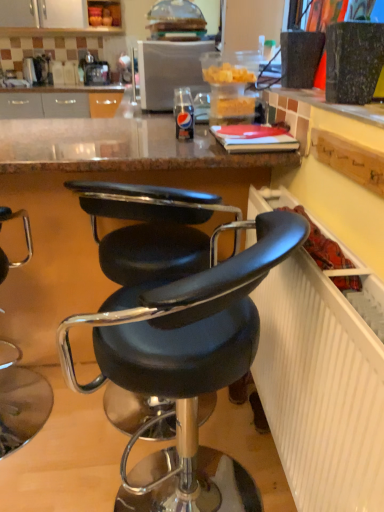
The height and width of the screenshot is (512, 384). Describe the element at coordinates (169, 71) in the screenshot. I see `satin silver microwave at upper center` at that location.

This screenshot has width=384, height=512. Describe the element at coordinates (21, 403) in the screenshot. I see `black leather stool at lower left, the second chair when ordered from right to left` at that location.

This screenshot has height=512, width=384. Find the location of `black leather chair at center, the 1th chair in the right-to-left sequence`. black leather chair at center, the 1th chair in the right-to-left sequence is located at coordinates (186, 367).

You are a GUI agent. You are given a task and a screenshot of the screen. Output one action in this format:
    pyautogui.click(x=<x>, y=<y>)
    Task: Click on the satin silver microwave at upper center
    The width and height of the screenshot is (384, 512).
    Given the screenshot: What is the action you would take?
    pyautogui.click(x=169, y=71)

What's the angular difference between black leather chair at center, positioned as the 2th chair in left-to-right order, and satin silver microwave at upper center's facing directions?

black leather chair at center, positioned as the 2th chair in left-to-right order, and satin silver microwave at upper center are facing 91.2 degrees away from each other.

Between black leather chair at center, positioned as the 2th chair in left-to-right order, and satin silver microwave at upper center, which one has larger size?

black leather chair at center, positioned as the 2th chair in left-to-right order, is bigger.

From the image's perspective, which is below, black leather chair at center, the 1th chair in the right-to-left sequence, or satin silver microwave at upper center?

black leather chair at center, the 1th chair in the right-to-left sequence, is shown below in the image.

Where is `appliance above the black leather chair at center, positioned as the 2th chair in left-to-right order (from a real-world perspective)`? appliance above the black leather chair at center, positioned as the 2th chair in left-to-right order (from a real-world perspective) is located at coordinates (169, 71).

Consider the image. From the image's perspective, which object appears higher, black leather chair at center, positioned as the 2th chair in left-to-right order, or black leather stool at lower left, the second chair when ordered from right to left?

black leather stool at lower left, the second chair when ordered from right to left, is shown above in the image.

How much distance is there between black leather chair at center, the 1th chair in the right-to-left sequence, and black leather stool at lower left, marked as the 1th chair in a left-to-right arrangement?

They are 28.07 inches apart.

Is point (163, 311) behind point (47, 397)?

No, (163, 311) is closer to viewer.

Is black leather stool at lower left, the second chair when ordered from right to left, positioned before white textured radiator at lower right?

No, black leather stool at lower left, the second chair when ordered from right to left, is further to the viewer.

Which is in front, point (1, 276) or point (278, 281)?

Positioned in front is point (278, 281).

From the image's perspective, which one is positioned lower, black leather stool at lower left, marked as the 1th chair in a left-to-right arrangement, or white textured radiator at lower right?

white textured radiator at lower right appears lower in the image.

In the scene shown: Can you confirm if black leather stool at lower left, the second chair when ordered from right to left, is smaller than white textured radiator at lower right?

No, black leather stool at lower left, the second chair when ordered from right to left, is not smaller than white textured radiator at lower right.

From the image's perspective, would you say black leather stool at lower left, marked as the 1th chair in a left-to-right arrangement, is shown under black leather chair at center, positioned as the 2th chair in left-to-right order?

No, from the image's perspective, black leather stool at lower left, marked as the 1th chair in a left-to-right arrangement, is not beneath black leather chair at center, positioned as the 2th chair in left-to-right order.

Does black leather stool at lower left, the second chair when ordered from right to left, lie in front of black leather chair at center, positioned as the 2th chair in left-to-right order?

No, it is behind black leather chair at center, positioned as the 2th chair in left-to-right order.

Based on the photo, are black leather stool at lower left, the second chair when ordered from right to left, and black leather chair at center, the 1th chair in the right-to-left sequence, located far from each other?

black leather stool at lower left, the second chair when ordered from right to left, is actually quite close to black leather chair at center, the 1th chair in the right-to-left sequence.

Is black leather stool at lower left, marked as the 1th chair in a left-to-right arrangement, facing away from black leather chair at center, the 1th chair in the right-to-left sequence?

black leather stool at lower left, marked as the 1th chair in a left-to-right arrangement, does not have its back to black leather chair at center, the 1th chair in the right-to-left sequence.

Is white textured radiator at lower right facing towards black leather chair at center, positioned as the 2th chair in left-to-right order?

Yes, white textured radiator at lower right is oriented towards black leather chair at center, positioned as the 2th chair in left-to-right order.

Does white textured radiator at lower right appear on the left side of black leather chair at center, the 1th chair in the right-to-left sequence?

No.

Which of these two, white textured radiator at lower right or black leather chair at center, the 1th chair in the right-to-left sequence, is bigger?

Bigger between the two is black leather chair at center, the 1th chair in the right-to-left sequence.

Consider the image. From a real-world perspective, is satin silver microwave at upper center physically located above or below black leather chair at center, the 1th chair in the right-to-left sequence?

Clearly, from a real-world perspective, satin silver microwave at upper center is above black leather chair at center, the 1th chair in the right-to-left sequence.

Based on the photo, between satin silver microwave at upper center and black leather chair at center, positioned as the 2th chair in left-to-right order, which one has less height?

satin silver microwave at upper center.

Looking at this image, is satin silver microwave at upper center positioned beyond the bounds of black leather chair at center, positioned as the 2th chair in left-to-right order?

satin silver microwave at upper center lies outside black leather chair at center, positioned as the 2th chair in left-to-right order,'s area.

Does satin silver microwave at upper center lie behind black leather chair at center, the 1th chair in the right-to-left sequence?

Yes, it is.

Could you tell me if white textured radiator at lower right is turned towards satin silver microwave at upper center?

No, white textured radiator at lower right is not aimed at satin silver microwave at upper center.

From the image's perspective, is white textured radiator at lower right located above or below satin silver microwave at upper center?

Based on their image positions, white textured radiator at lower right is located beneath satin silver microwave at upper center.

Is white textured radiator at lower right in front of satin silver microwave at upper center?

Yes, it is.

This screenshot has width=384, height=512. Find the location of `chair that is on the right side of satin silver microwave at upper center`. chair that is on the right side of satin silver microwave at upper center is located at coordinates (186, 367).

There is a black leather stool at lower left, the second chair when ordered from right to left. Where is `chair above it (from a real-world perspective)`? Image resolution: width=384 pixels, height=512 pixels. chair above it (from a real-world perspective) is located at coordinates (186, 367).

Based on their spatial positions, is satin silver microwave at upper center or black leather stool at lower left, the second chair when ordered from right to left, further from black leather chair at center, positioned as the 2th chair in left-to-right order?

satin silver microwave at upper center lies further to black leather chair at center, positioned as the 2th chair in left-to-right order, than the other object.

Based on their spatial positions, is black leather chair at center, the 1th chair in the right-to-left sequence, or black leather stool at lower left, the second chair when ordered from right to left, closer to white textured radiator at lower right?

black leather chair at center, the 1th chair in the right-to-left sequence.

Estimate the real-world distances between objects in this image. Which object is closer to white textured radiator at lower right, black leather chair at center, the 1th chair in the right-to-left sequence, or satin silver microwave at upper center?

black leather chair at center, the 1th chair in the right-to-left sequence, is closer to white textured radiator at lower right.

Considering their positions, is black leather chair at center, positioned as the 2th chair in left-to-right order, positioned further to black leather stool at lower left, marked as the 1th chair in a left-to-right arrangement, than satin silver microwave at upper center?

satin silver microwave at upper center lies further to black leather stool at lower left, marked as the 1th chair in a left-to-right arrangement, than the other object.

Estimate the real-world distances between objects in this image. Which object is closer to satin silver microwave at upper center, white textured radiator at lower right or black leather stool at lower left, the second chair when ordered from right to left?

Among the two, black leather stool at lower left, the second chair when ordered from right to left, is located nearer to satin silver microwave at upper center.

Looking at the image, which one is located further to black leather chair at center, the 1th chair in the right-to-left sequence, white textured radiator at lower right or black leather stool at lower left, the second chair when ordered from right to left?

The object further to black leather chair at center, the 1th chair in the right-to-left sequence, is black leather stool at lower left, the second chair when ordered from right to left.

Which object lies further to the anchor point satin silver microwave at upper center, white textured radiator at lower right or black leather chair at center, positioned as the 2th chair in left-to-right order?

white textured radiator at lower right is positioned further to the anchor satin silver microwave at upper center.

From the picture: When comparing their distances from white textured radiator at lower right, does satin silver microwave at upper center or black leather stool at lower left, marked as the 1th chair in a left-to-right arrangement, seem closer?

black leather stool at lower left, marked as the 1th chair in a left-to-right arrangement, is closer to white textured radiator at lower right.

The image size is (384, 512). I want to click on chair between black leather stool at lower left, the second chair when ordered from right to left, and white textured radiator at lower right from left to right, so click(x=186, y=367).

Where is `chair positioned between black leather chair at center, the 1th chair in the right-to-left sequence, and satin silver microwave at upper center from near to far`? chair positioned between black leather chair at center, the 1th chair in the right-to-left sequence, and satin silver microwave at upper center from near to far is located at coordinates (21, 403).